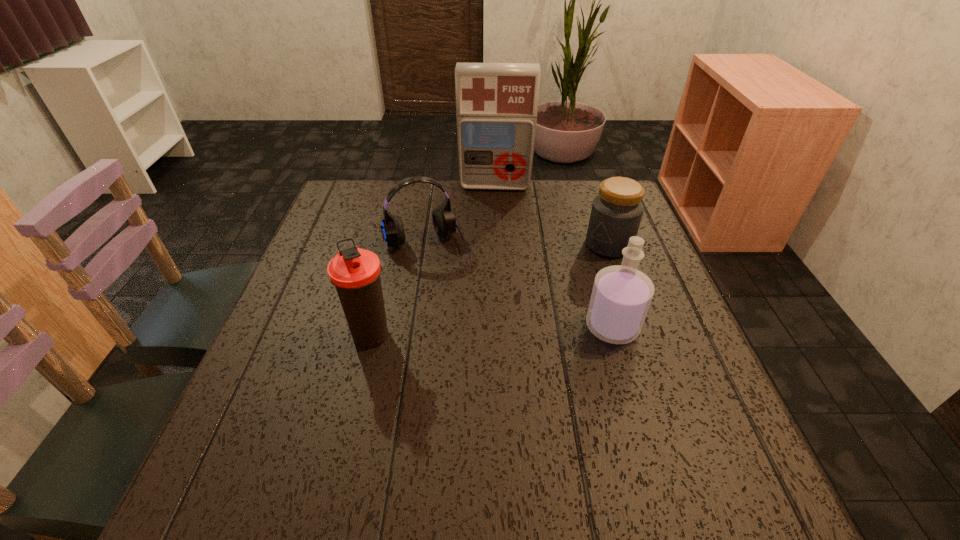
Where is `vacant space on the desktop that is between the thermos bottle and the perfume and is positioned on the ear cushions of the headset`? This screenshot has height=540, width=960. vacant space on the desktop that is between the thermos bottle and the perfume and is positioned on the ear cushions of the headset is located at coordinates (462, 332).

Image resolution: width=960 pixels, height=540 pixels. I want to click on free spot on the desktop that is between the thermos bottle and the perfume and is positioned on the surface of the jar near the warning symbol, so click(473, 332).

Locate an element on the screen. This screenshot has height=540, width=960. free space on the desktop that is between the thermos bottle and the perfume and is positioned on the front-facing side of the first-aid kit is located at coordinates (491, 331).